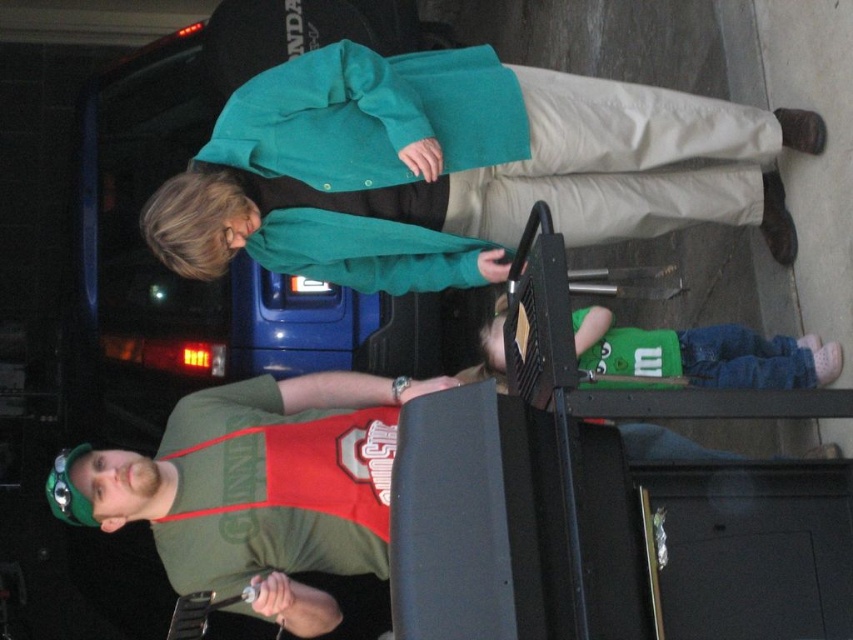
Question: Is teal fabric coat at upper center bigger than black plastic lift at lower center?

Choices:
 (A) no
 (B) yes

Answer: (B)

Question: Which point is farther to the camera?

Choices:
 (A) teal fabric coat at upper center
 (B) green matte shirt at lower right

Answer: (A)

Question: Which point is closer to the camera?

Choices:
 (A) (68, 513)
 (B) (212, 147)

Answer: (A)

Question: Is teal fabric coat at upper center smaller than green matte t-shirt at center?

Choices:
 (A) no
 (B) yes

Answer: (A)

Question: Which object is the farthest from the black plastic lift at lower center?

Choices:
 (A) teal fabric coat at upper center
 (B) green matte shirt at lower right
 (C) green matte t-shirt at center

Answer: (A)

Question: Is black plastic lift at lower center smaller than green matte t-shirt at center?

Choices:
 (A) yes
 (B) no

Answer: (A)